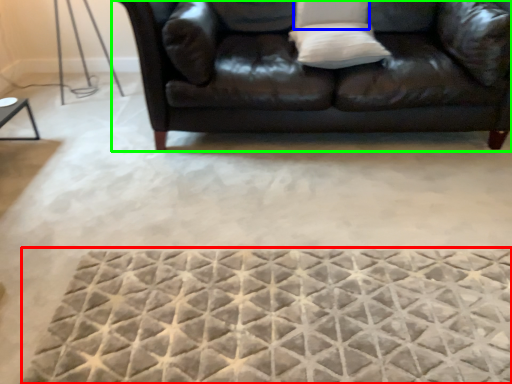
Question: Which is farther away from mat (highlighted by a red box)? pillow (highlighted by a blue box) or studio couch (highlighted by a green box)?

Choices:
 (A) pillow
 (B) studio couch

Answer: (A)